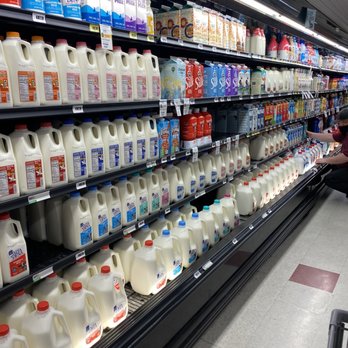
Image resolution: width=348 pixels, height=348 pixels. Find the location of `half gallons of milk with light blue labels`. half gallons of milk with light blue labels is located at coordinates (78, 227), (62, 222), (40, 221), (24, 219), (100, 223), (114, 217), (130, 213).